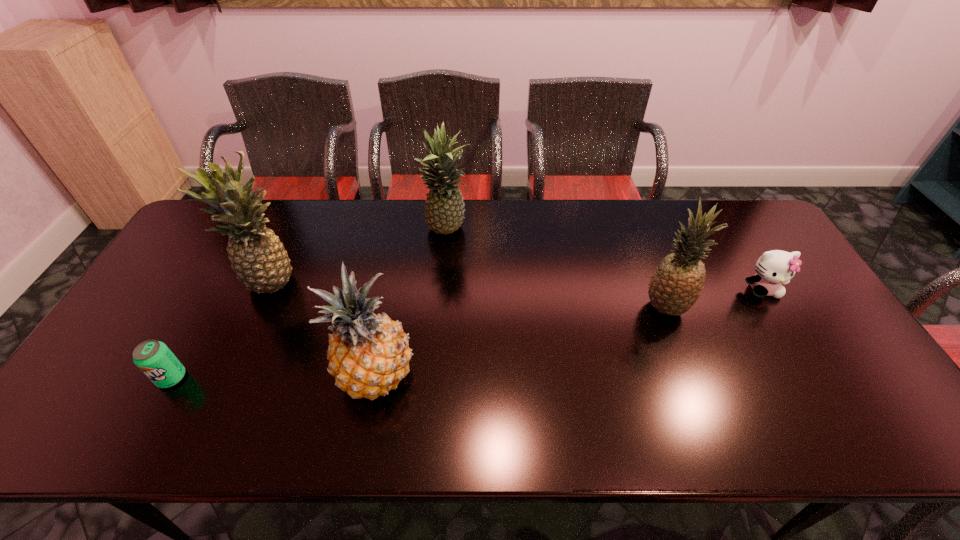
Locate an element on the screen. The height and width of the screenshot is (540, 960). vacant position located 0.250m on the left of the rightmost pineapple is located at coordinates (554, 307).

You are a GUI agent. You are given a task and a screenshot of the screen. Output one action in this format:
    pyautogui.click(x=<x>, y=<y>)
    Task: Click on the free point located 0.360m on the right of the nearest pineapple
    Image resolution: width=960 pixels, height=540 pixels.
    Given the screenshot: What is the action you would take?
    pyautogui.click(x=564, y=376)

Image resolution: width=960 pixels, height=540 pixels. I want to click on free space located 0.170m on the front-facing side of the second shortest object, so click(800, 351).

Find the location of a particular element. The width and height of the screenshot is (960, 540). free space located on the front-facing side of the shortest object is located at coordinates (140, 435).

You are a GUI agent. You are given a task and a screenshot of the screen. Output one action in this format:
    pyautogui.click(x=<x>, y=<y>)
    Task: Click on the object present at the far edge
    The image size is (960, 540).
    Given the screenshot: What is the action you would take?
    pyautogui.click(x=444, y=212)

Locate an element on the screen. This screenshot has width=960, height=540. object located at the near edge is located at coordinates (369, 355).

Where is `object situated at the right edge`? object situated at the right edge is located at coordinates (775, 267).

I want to click on vacant space at the far edge of the desktop, so click(340, 215).

This screenshot has width=960, height=540. Identify the location of vacant space at the near edge. (303, 419).

In the image, there is a desktop. At what (x,y) coordinates should I click in order to perform the action: click on free space at the left edge. Please return your answer as a coordinate pair (x, y). Looking at the image, I should click on click(x=196, y=280).